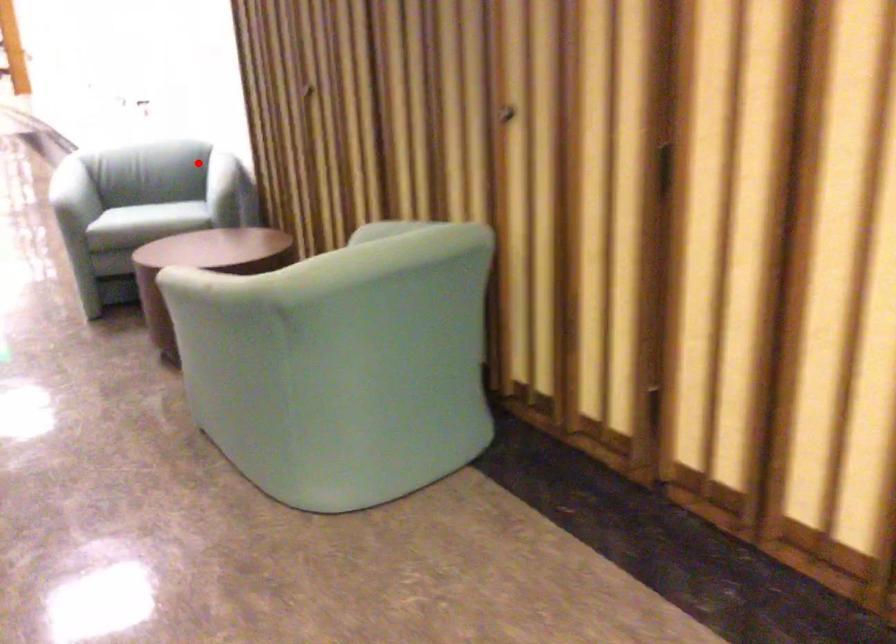
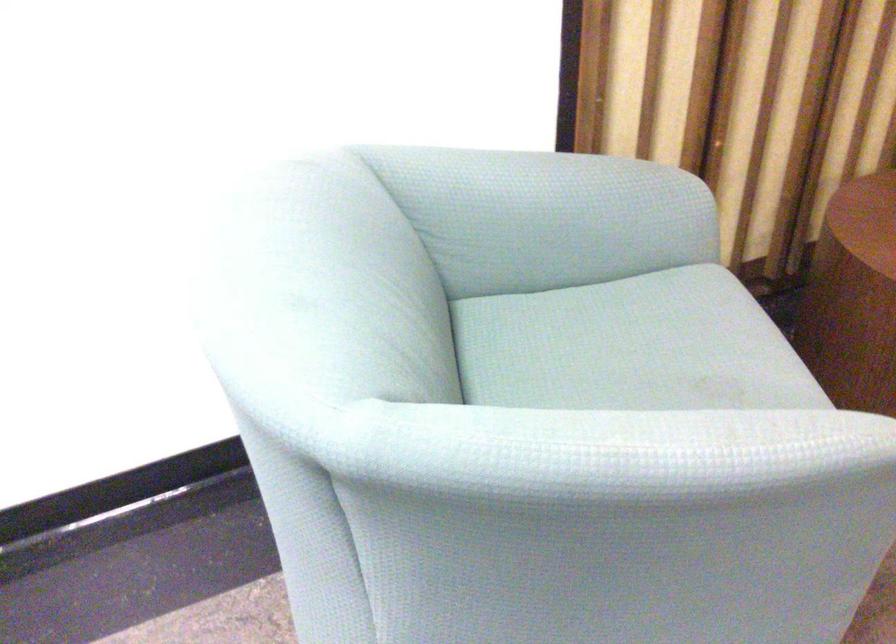
Locate, in the second image, the point that corresponds to the highlighted location in the first image.

(545, 216)